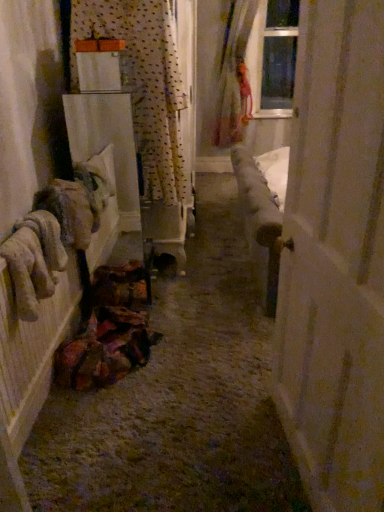
Image resolution: width=384 pixels, height=512 pixels. What do you see at coordinates (143, 84) in the screenshot? I see `polka dot fabric curtain at upper left, the 1th curtain in the bottom-to-top sequence` at bounding box center [143, 84].

Measure the distance between point [158,19] and camera.

Point [158,19] and camera are 2.06 meters apart from each other.

Consider the image. What is the approximate width of translucent fabric curtain at upper right, which is counted as the second curtain, starting from the left?

translucent fabric curtain at upper right, which is counted as the second curtain, starting from the left, is 10.76 inches wide.

Locate an element on the screen. Image resolution: width=384 pixels, height=512 pixels. translucent fabric curtain at upper right, acting as the 1th curtain starting from the right is located at coordinates (234, 76).

Locate an element on the screen. This screenshot has width=384, height=512. fuzzy beige gloves at left is located at coordinates (34, 261).

Is white matte door at right next to textured fabric bag at lower left and touching it?

No, white matte door at right is not touching textured fabric bag at lower left.

Is white matte door at right smaller than textured fabric bag at lower left?

Correct, white matte door at right occupies less space than textured fabric bag at lower left.

Is white matte door at right to the left of textured fabric bag at lower left from the viewer's perspective?

In fact, white matte door at right is to the right of textured fabric bag at lower left.

Is white matte door at right taller than textured fabric bag at lower left?

Yes.

From the image's perspective, does translucent fabric curtain at upper right, which is counted as the second curtain, starting from the left, appear lower than fuzzy beige gloves at left?

No, from the image's perspective, translucent fabric curtain at upper right, which is counted as the second curtain, starting from the left, is not beneath fuzzy beige gloves at left.

Between point (237, 63) and point (59, 249), which one is positioned behind?

Positioned behind is point (237, 63).

How different are the orientations of translucent fabric curtain at upper right, which is counted as the second curtain, starting from the left, and fuzzy beige gloves at left in degrees?

90.4 degrees.

Is translucent fabric curtain at upper right, the 2th curtain positioned from the front, looking in the opposite direction of fuzzy beige gloves at left?

No, translucent fabric curtain at upper right, the 2th curtain positioned from the front, is not facing the opposite direction of fuzzy beige gloves at left.

Which is nearer, (144, 54) or (278, 293)?

Point (144, 54) appears to be farther away from the viewer than point (278, 293).

Considering the relative sizes of polka dot fabric curtain at upper left, placed as the 1th curtain when sorted from left to right, and white matte door at right in the image provided, is polka dot fabric curtain at upper left, placed as the 1th curtain when sorted from left to right, shorter than white matte door at right?

Correct, polka dot fabric curtain at upper left, placed as the 1th curtain when sorted from left to right, is not as tall as white matte door at right.

Considering the sizes of polka dot fabric curtain at upper left, placed as the second curtain when sorted from back to front, and white matte door at right in the image, is polka dot fabric curtain at upper left, placed as the second curtain when sorted from back to front, wider or thinner than white matte door at right?

polka dot fabric curtain at upper left, placed as the second curtain when sorted from back to front, is wider than white matte door at right.

From a real-world perspective, is polka dot fabric curtain at upper left, placed as the second curtain when sorted from back to front, positioned above or below white matte door at right?

In terms of real-world spatial position, polka dot fabric curtain at upper left, placed as the second curtain when sorted from back to front, is above white matte door at right.

Consider the image. Which object is wider, fuzzy beige gloves at left or white matte door at right?

fuzzy beige gloves at left.

Who is taller, fuzzy beige gloves at left or white matte door at right?

Standing taller between the two is white matte door at right.

Is fuzzy beige gloves at left next to white matte door at right and touching it?

No, fuzzy beige gloves at left is not touching white matte door at right.

Considering their positions, is fuzzy beige gloves at left located in front of or behind white matte door at right?

Visually, fuzzy beige gloves at left is located behind white matte door at right.

Can polka dot fabric curtain at upper left, the first curtain positioned from the front, be found inside translucent fabric curtain at upper right, which appears as the first curtain when viewed from the back?

No, polka dot fabric curtain at upper left, the first curtain positioned from the front, is not inside translucent fabric curtain at upper right, which appears as the first curtain when viewed from the back.

Who is smaller, translucent fabric curtain at upper right, which appears as the first curtain when viewed from the back, or polka dot fabric curtain at upper left, the first curtain positioned from the front?

With smaller size is polka dot fabric curtain at upper left, the first curtain positioned from the front.

Is translucent fabric curtain at upper right, arranged as the second curtain when ordered from the bottom, facing towards polka dot fabric curtain at upper left, placed as the second curtain when sorted from back to front?

Yes, translucent fabric curtain at upper right, arranged as the second curtain when ordered from the bottom, is oriented towards polka dot fabric curtain at upper left, placed as the second curtain when sorted from back to front.

From the image's perspective, would you say translucent fabric curtain at upper right, the 2th curtain positioned from the front, is positioned over polka dot fabric curtain at upper left, the 1th curtain in the bottom-to-top sequence?

Yes.

Is polka dot fabric curtain at upper left, placed as the 1th curtain when sorted from left to right, thinner than textured fabric bag at lower left?

Indeed, polka dot fabric curtain at upper left, placed as the 1th curtain when sorted from left to right, has a lesser width compared to textured fabric bag at lower left.

Can we say polka dot fabric curtain at upper left, the 1th curtain in the bottom-to-top sequence, lies outside textured fabric bag at lower left?

Absolutely, polka dot fabric curtain at upper left, the 1th curtain in the bottom-to-top sequence, is external to textured fabric bag at lower left.

Is polka dot fabric curtain at upper left, placed as the 1th curtain when sorted from left to right, oriented away from textured fabric bag at lower left?

polka dot fabric curtain at upper left, placed as the 1th curtain when sorted from left to right, is not turned away from textured fabric bag at lower left.

Is point (156, 147) behind point (109, 506)?

Yes, it is.

Is fuzzy beige gloves at left surrounded by textured fabric bag at lower left?

No.

Is textured fabric bag at lower left positioned with its back to fuzzy beige gloves at left?

No.

Based on their sizes in the image, would you say textured fabric bag at lower left is bigger or smaller than fuzzy beige gloves at left?

Considering their sizes, textured fabric bag at lower left takes up more space than fuzzy beige gloves at left.

Between textured fabric bag at lower left and fuzzy beige gloves at left, which one appears on the left side from the viewer's perspective?

fuzzy beige gloves at left is more to the left.

At what (x,y) coordinates should I click in order to perform the action: click on path behind the white matte door at right. Please return your answer as a coordinate pair (x, y). Looking at the image, I should click on (179, 399).

I want to click on clothing below the translucent fabric curtain at upper right, arranged as the second curtain when ordered from the bottom (from a real-world perspective), so click(x=34, y=261).

Estimate the real-world distances between objects in this image. Which object is closer to polka dot fabric curtain at upper left, marked as the 2th curtain in a top-to-bottom arrangement, fuzzy beige gloves at left or white matte door at right?

fuzzy beige gloves at left is positioned closer to the anchor polka dot fabric curtain at upper left, marked as the 2th curtain in a top-to-bottom arrangement.

Based on their spatial positions, is white matte door at right or textured fabric bag at lower left further from polka dot fabric curtain at upper left, which is the second curtain in right-to-left order?

Based on the image, white matte door at right appears to be further to polka dot fabric curtain at upper left, which is the second curtain in right-to-left order.

Consider the image. Looking at the image, which one is located closer to textured fabric bag at lower left, fuzzy beige gloves at left or white matte door at right?

white matte door at right lies closer to textured fabric bag at lower left than the other object.

When comparing their distances from fuzzy beige gloves at left, does polka dot fabric curtain at upper left, marked as the 2th curtain in a top-to-bottom arrangement, or white matte door at right seem further?

polka dot fabric curtain at upper left, marked as the 2th curtain in a top-to-bottom arrangement.

Considering their positions, is polka dot fabric curtain at upper left, the 1th curtain in the bottom-to-top sequence, positioned further to textured fabric bag at lower left than white matte door at right?

polka dot fabric curtain at upper left, the 1th curtain in the bottom-to-top sequence.

Consider the image. Looking at the image, which one is located closer to polka dot fabric curtain at upper left, placed as the 1th curtain when sorted from left to right, fuzzy beige gloves at left or translucent fabric curtain at upper right, which appears as the first curtain when viewed from the back?

fuzzy beige gloves at left is closer to polka dot fabric curtain at upper left, placed as the 1th curtain when sorted from left to right.

When comparing their distances from white matte door at right, does polka dot fabric curtain at upper left, the first curtain positioned from the front, or translucent fabric curtain at upper right, the 2th curtain positioned from the front, seem further?

translucent fabric curtain at upper right, the 2th curtain positioned from the front, is positioned further to the anchor white matte door at right.

Based on their spatial positions, is textured fabric bag at lower left or translucent fabric curtain at upper right, which is counted as the second curtain, starting from the left, closer to polka dot fabric curtain at upper left, marked as the 2th curtain in a top-to-bottom arrangement?

textured fabric bag at lower left.

Image resolution: width=384 pixels, height=512 pixels. Identify the location of curtain positioned between textured fabric bag at lower left and translucent fabric curtain at upper right, acting as the 1th curtain starting from the right, from near to far. (143, 84).

Locate an element on the screen. The width and height of the screenshot is (384, 512). path between white matte door at right and fuzzy beige gloves at left along the z-axis is located at coordinates (179, 399).

At what (x,y) coordinates should I click in order to perform the action: click on curtain between white matte door at right and translucent fabric curtain at upper right, acting as the 1th curtain starting from the right, in the front-back direction. Please return your answer as a coordinate pair (x, y). Looking at the image, I should click on (143, 84).

You are a GUI agent. You are given a task and a screenshot of the screen. Output one action in this format:
    pyautogui.click(x=<x>, y=<y>)
    Task: Click on the clothing between white matte door at right and translucent fabric curtain at upper right, which is the first curtain in top-to-bottom order, in the front-back direction
    This screenshot has height=512, width=384.
    Given the screenshot: What is the action you would take?
    pyautogui.click(x=34, y=261)